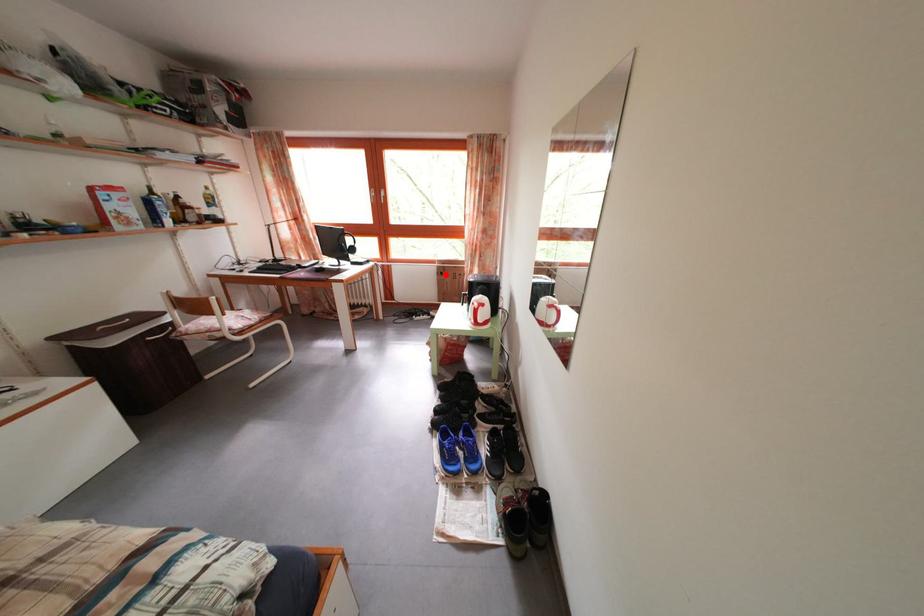
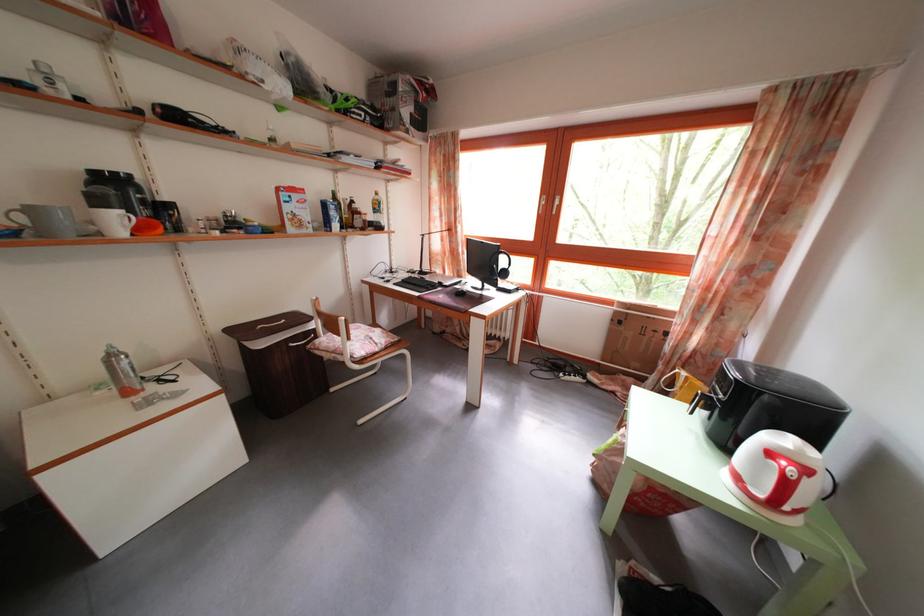
Question: I am providing you with two images of the same scene from different viewpoints. Image1 has a red point marked. In image2, the corresponding 3D location appears at what relative position? Reply with the corresponding letter.

Choices:
 (A) Closer
 (B) Farther

Answer: (B)